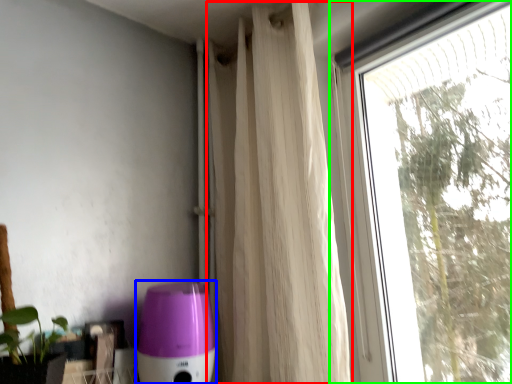
Question: Estimate the real-world distances between objects in this image. Which object is farther from curtain (highlighted by a red box), appliance (highlighted by a blue box) or window (highlighted by a green box)?

Choices:
 (A) appliance
 (B) window

Answer: (B)